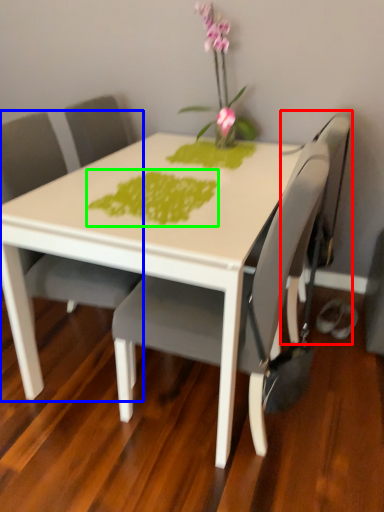
Question: Estimate the real-world distances between objects in this image. Which object is farther from swivel chair (highlighted by a red box), chair (highlighted by a blue box) or design (highlighted by a green box)?

Choices:
 (A) chair
 (B) design

Answer: (A)